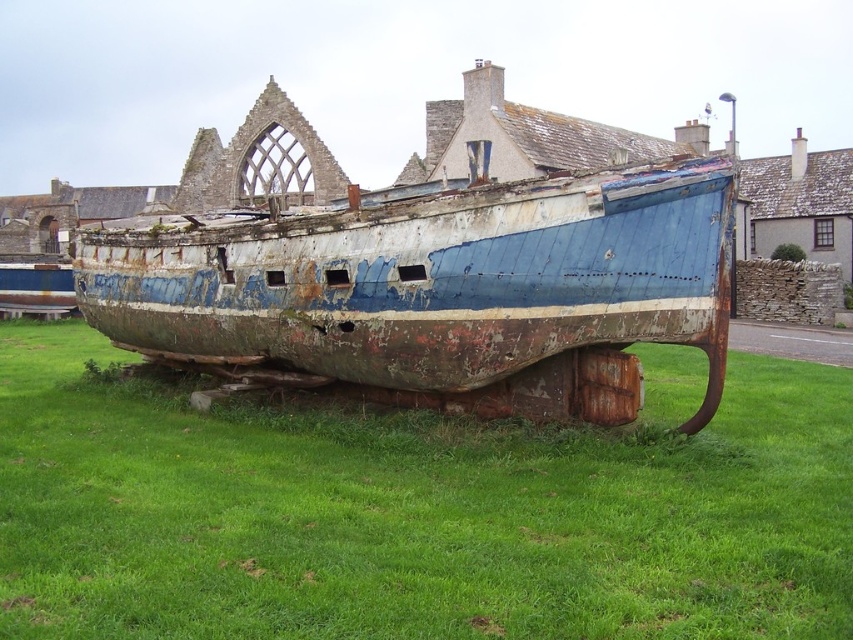
Question: Where is green grass at center located in relation to rusty metal boat at center in the image?

Choices:
 (A) left
 (B) right

Answer: (B)

Question: Can you confirm if green grass at center is positioned below rusty metal boat at center?

Choices:
 (A) yes
 (B) no

Answer: (A)

Question: Is green grass at center behind rusty metal boat at center?

Choices:
 (A) no
 (B) yes

Answer: (A)

Question: Which point appears closest to the camera in this image?

Choices:
 (A) [x=405, y=355]
 (B) [x=292, y=556]

Answer: (B)

Question: Which point is closer to the camera?

Choices:
 (A) green grass at center
 (B) rusty metal boat at center

Answer: (A)